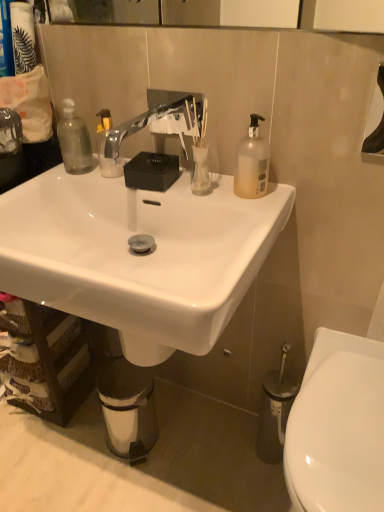
Locate an element on the screen. The image size is (384, 512). free location in front of translucent plastic bottle at upper right is located at coordinates (256, 213).